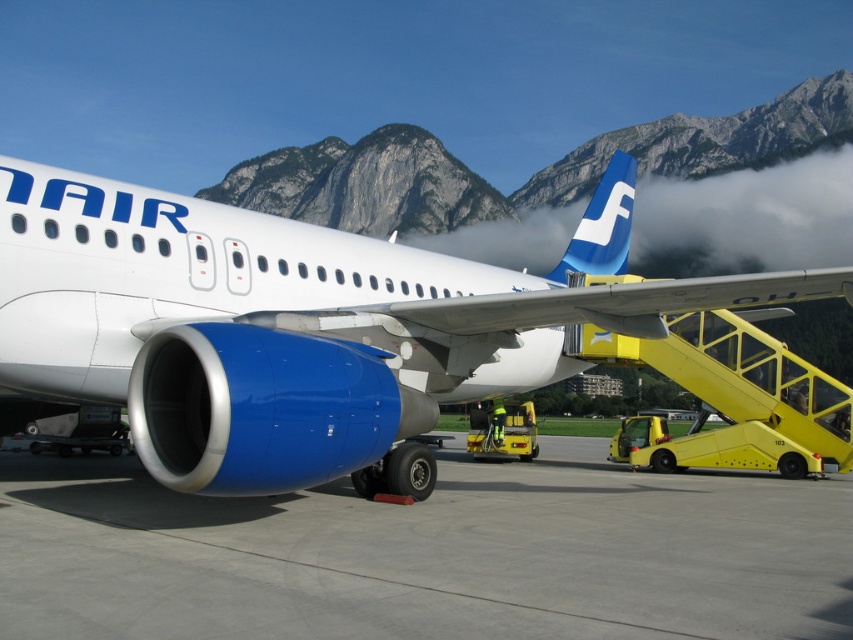
Based on the photo, you are standing on the airport tarmac and see the point marked at coordinate (285, 326). What object is located at that point?

The point at coordinate (285, 326) marks the blue metallic airplane at center.

You are a passenger waiting to board the airplane. You see the blue metallic airplane at center and the blue matte tail at upper center. Which object is closer to the left side of the image?

The blue metallic airplane at center is closer to the left side of the image because it is positioned to the left of the blue matte tail at upper center.